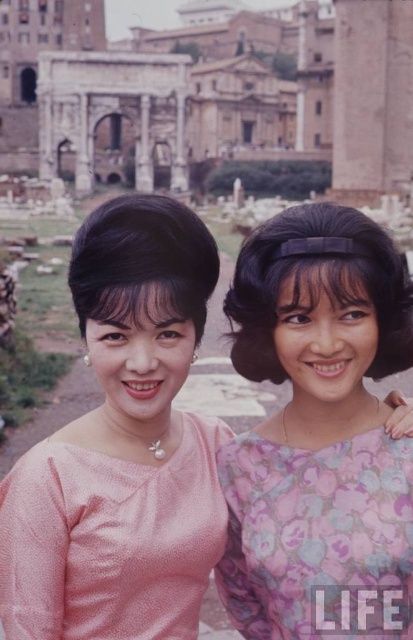
You are a photographer wanting to capture the pink satin dress at center in the image. The camera is positioned at point 0.0, 0.0. The coordinate system is such that 0.0,0.0 is the bottom left corner, and 1.0,1.0 is the top right corner. The pink satin dress at center is located at point (123,445). To ensure the dress is in focus, you need to adjust the camera lens to the correct focal length. Given that the focal length required is inversely proportional to the distance from the camera to the subject, a

The pink satin dress at center is located at point (123,445), so you should adjust the camera lens to a focal length appropriate for that distance to keep the dress in focus.

You are a photographer trying to capture a clear shot of both the pink floral dress at center and the pink textured dress at center. Since you want to ensure both dresses are visible, which dress might need to be moved closer to the camera to avoid appearing too small in the photo?

The pink textured dress at center has a smaller size compared to the pink floral dress at center, so moving it closer would help it appear larger in the photo.